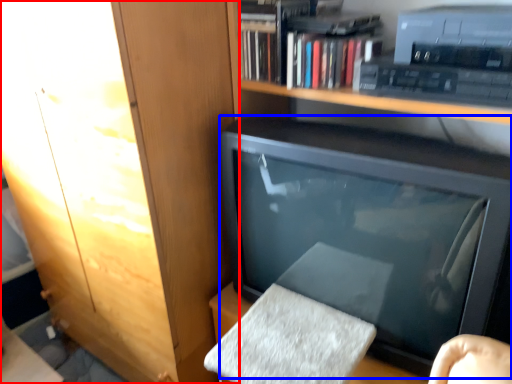
Question: Among these objects, which one is nearest to the camera, cabinetry (highlighted by a red box) or television (highlighted by a blue box)?

Choices:
 (A) cabinetry
 (B) television

Answer: (B)